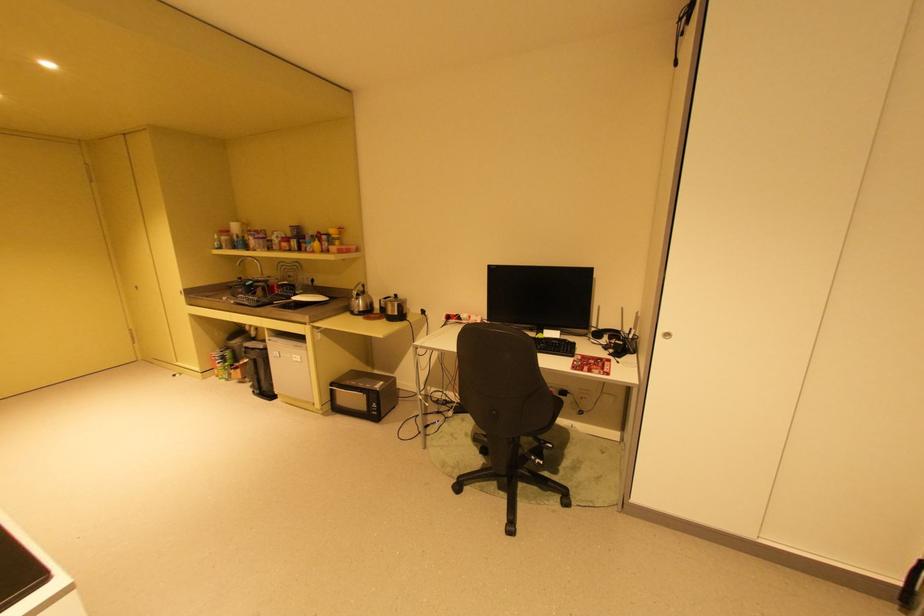
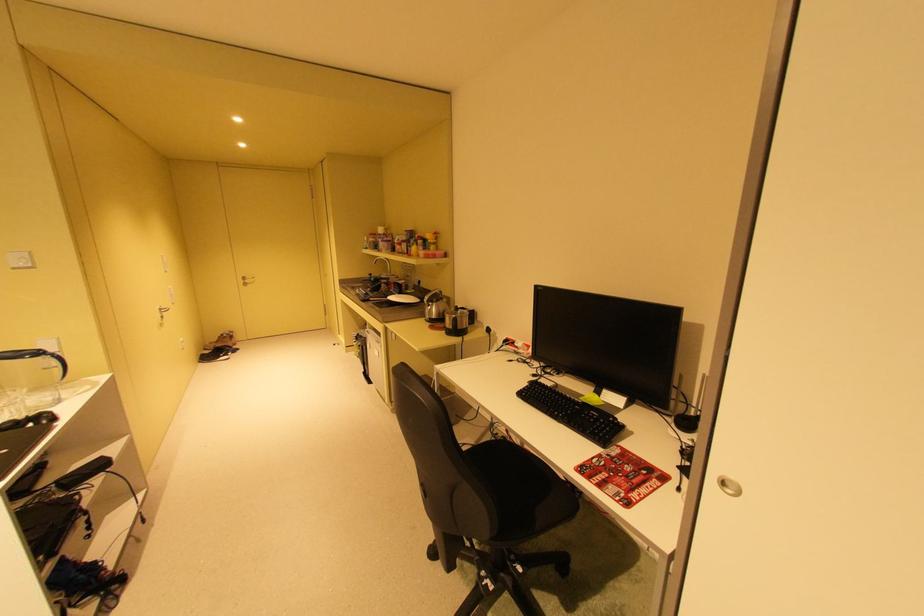
Question: The first image is from the beginning of the video and the second image is from the end. How did the camera likely rotate when shooting the video?

Choices:
 (A) Left
 (B) Right
 (C) Up
 (D) Down

Answer: (A)